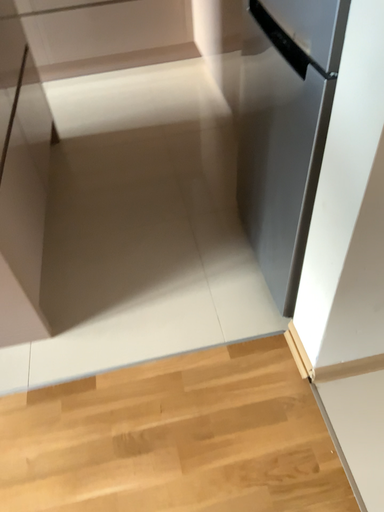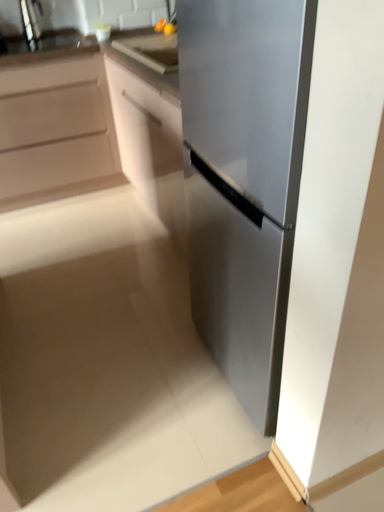
Question: Which way did the camera rotate in the video?

Choices:
 (A) rotated downward
 (B) rotated upward

Answer: (B)